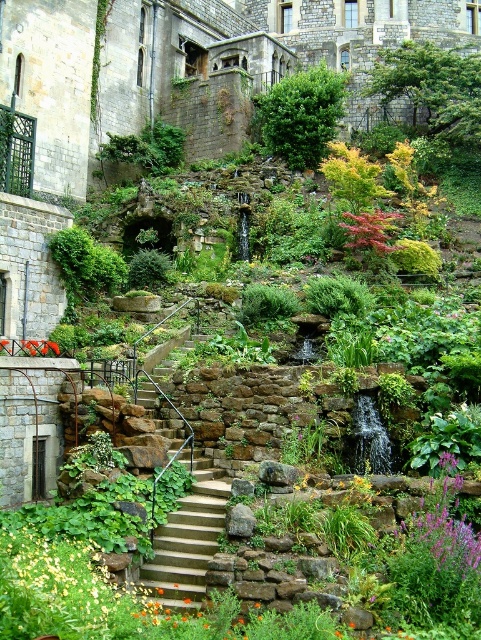
Question: Does purple fuzzy flower at center right have a greater width compared to glossy red leaf at center?

Choices:
 (A) yes
 (B) no

Answer: (B)

Question: Can you confirm if smooth concrete stairs at center is positioned to the left of glossy red leaf at center?

Choices:
 (A) no
 (B) yes

Answer: (B)

Question: Can you confirm if smooth concrete stairs at center is wider than glossy red leaf at center?

Choices:
 (A) yes
 (B) no

Answer: (A)

Question: Which point is farther from the camera taking this photo?

Choices:
 (A) (417, 515)
 (B) (357, 220)
 (C) (189, 524)

Answer: (B)

Question: Which of the following is the farthest from the observer?

Choices:
 (A) (151, 595)
 (B) (369, 240)

Answer: (B)

Question: Which of the following is the farthest from the observer?

Choices:
 (A) glossy red leaf at center
 (B) smooth concrete stairs at center

Answer: (A)